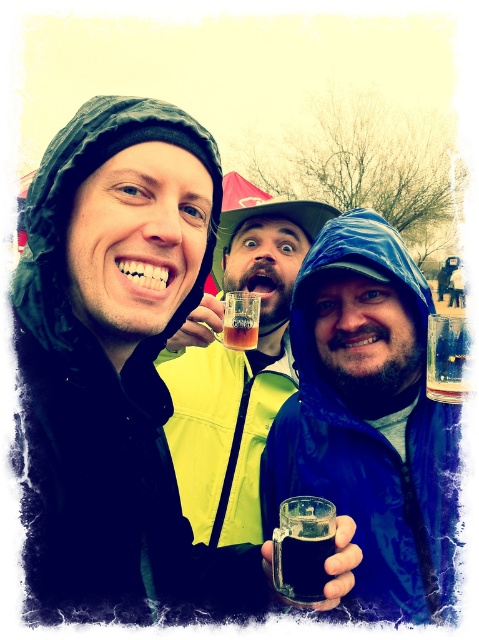
Question: Based on their relative distances, which object is nearer to the dark glass mug at center?

Choices:
 (A) translucent plastic cup at center
 (B) matte plastic cup at center
 (C) clear glass at center

Answer: (C)

Question: Among these points, which one is farthest from the camera?

Choices:
 (A) (262, 291)
 (B) (75, 150)
 (C) (457, 380)

Answer: (A)

Question: Can you confirm if clear glass at center is bigger than translucent plastic cup at center?

Choices:
 (A) no
 (B) yes

Answer: (A)

Question: Can you confirm if clear glass mug at center is smaller than translucent glass mug at center?

Choices:
 (A) yes
 (B) no

Answer: (B)

Question: Which point is closer to the camera taking this photo?

Choices:
 (A) (255, 378)
 (B) (158, 145)
 (C) (433, 365)
 (D) (321, 241)

Answer: (B)

Question: Observing the image, what is the correct spatial positioning of dark glass mug at center in reference to translucent plastic cup at center?

Choices:
 (A) left
 (B) right

Answer: (B)